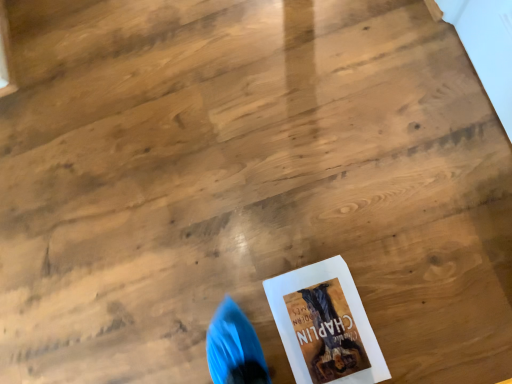
Describe the element at coordinates (325, 325) in the screenshot. The width and height of the screenshot is (512, 384). I see `white paper book at lower right` at that location.

What is the approximate width of white paper book at lower right?

white paper book at lower right is 30.97 centimeters wide.

Measure the distance between point (336, 362) and camera.

Point (336, 362) and camera are 99.70 centimeters apart from each other.

Where is `white paper book at lower right`? white paper book at lower right is located at coordinates (325, 325).

I want to click on white paper book at lower right, so pos(325,325).